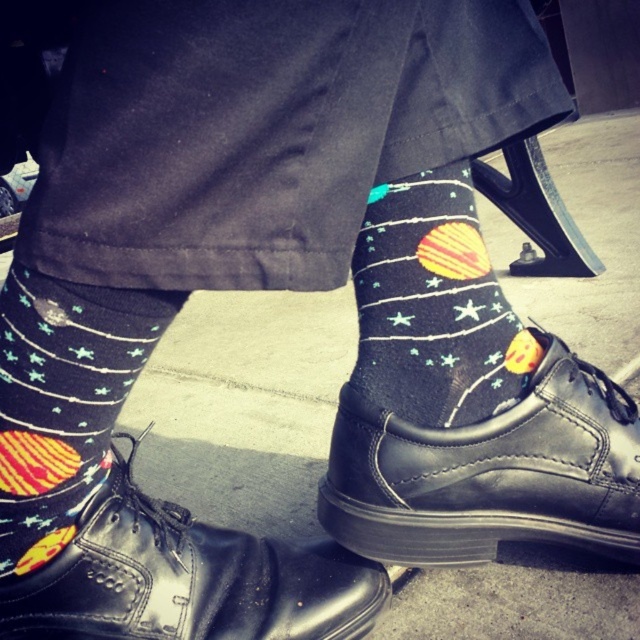
Question: Which point is closer to the camera?

Choices:
 (A) matte black socks with space design at lower left
 (B) space-themed socks at center
 (C) black leather shoe at center

Answer: (A)

Question: Can you confirm if black leather shoe at lower center is smaller than matte black socks with space design at lower left?

Choices:
 (A) no
 (B) yes

Answer: (A)

Question: Which point is farther to the camera?

Choices:
 (A) matte black socks with space design at lower left
 (B) black leather shoe at lower center
 (C) space-themed socks at center

Answer: (C)

Question: Does black leather shoe at center appear on the left side of matte black socks with space design at lower left?

Choices:
 (A) yes
 (B) no

Answer: (B)

Question: Which of these objects is positioned closest to the black leather shoe at center?

Choices:
 (A) space-themed socks at center
 (B) black leather shoe at lower center
 (C) matte black socks with space design at lower left

Answer: (A)

Question: Can you confirm if black leather shoe at center is thinner than matte black socks with space design at lower left?

Choices:
 (A) yes
 (B) no

Answer: (B)